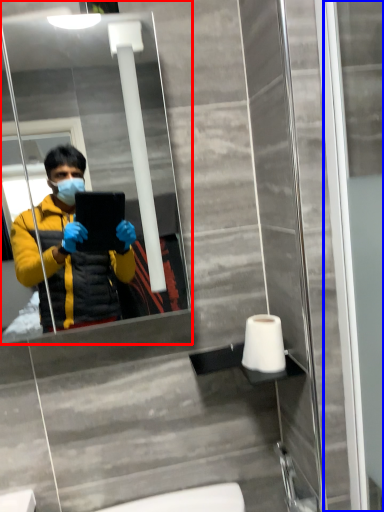
Question: Which object appears closest to the camera in this image, mirror (highlighted by a red box) or screen door (highlighted by a blue box)?

Choices:
 (A) mirror
 (B) screen door

Answer: (B)